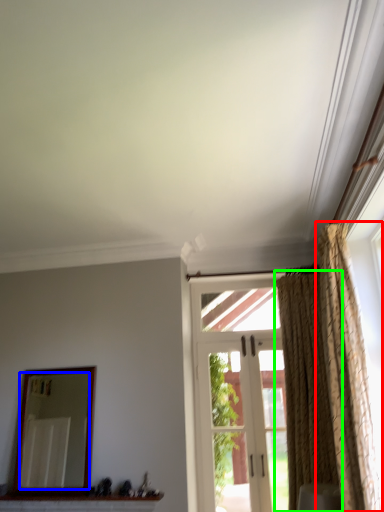
Question: Estimate the real-world distances between objects in this image. Which object is closer to curtain (highlighted by a red box), mirror (highlighted by a blue box) or curtain (highlighted by a green box)?

Choices:
 (A) mirror
 (B) curtain

Answer: (B)